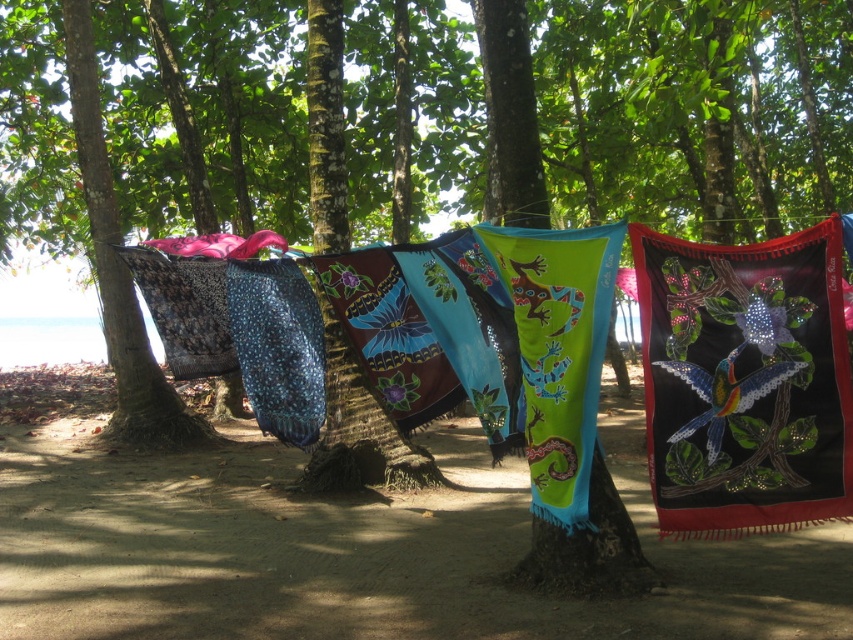
Question: Which is nearer to the black sequined cloth at center?

Choices:
 (A) blue knitted scarf at center
 (B) textured fabric beach towels at center
 (C) green fabric at center

Answer: (C)

Question: Which is farther from the blue knitted scarf at center?

Choices:
 (A) green fabric at center
 (B) textured fabric beach towels at center

Answer: (A)

Question: Does green fabric at center appear under blue knitted scarf at center?

Choices:
 (A) yes
 (B) no

Answer: (A)

Question: Does black sequined cloth at center have a lesser width compared to blue knitted scarf at center?

Choices:
 (A) no
 (B) yes

Answer: (A)

Question: Which point appears closest to the camera in this image?

Choices:
 (A) (825, 397)
 (B) (215, 477)

Answer: (A)

Question: Considering the relative positions of green fabric at center and blue knitted scarf at center in the image provided, where is green fabric at center located with respect to blue knitted scarf at center?

Choices:
 (A) below
 (B) above

Answer: (A)